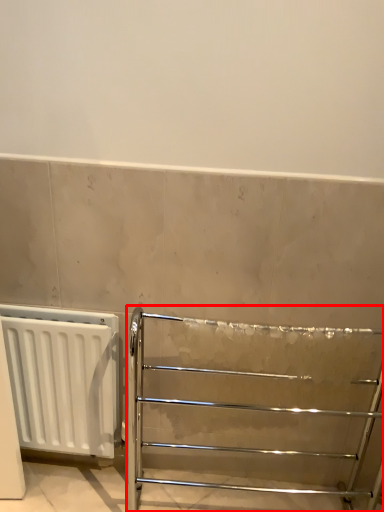
Question: Where is furniture (annotated by the red box) located in relation to radiator in the image?

Choices:
 (A) left
 (B) right

Answer: (B)